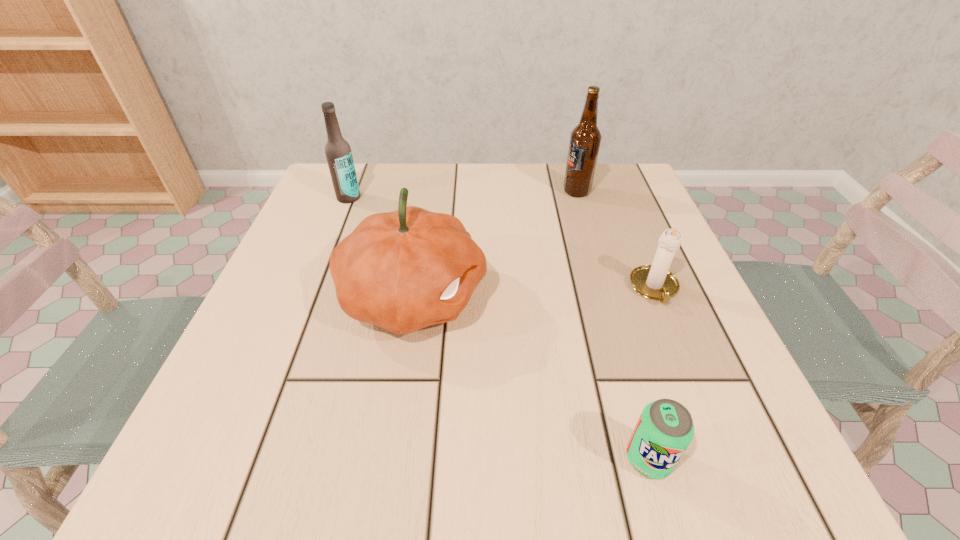
I want to click on vacant space located 0.070m on the label of the leftmost object, so click(x=339, y=222).

Find the location of a particular element. The width and height of the screenshot is (960, 540). free space located on the front face of the pumpkin is located at coordinates (699, 297).

Where is `vacant space located on the handle side of the second shortest object`? This screenshot has height=540, width=960. vacant space located on the handle side of the second shortest object is located at coordinates (696, 389).

The image size is (960, 540). I want to click on object that is positioned at the near edge, so click(x=665, y=428).

Locate an element on the screen. This screenshot has width=960, height=540. beer bottle situated at the left edge is located at coordinates (338, 152).

Where is `pumpkin that is positioned at the left edge`? The height and width of the screenshot is (540, 960). pumpkin that is positioned at the left edge is located at coordinates (404, 270).

At what (x,y) coordinates should I click in order to perform the action: click on beer bottle present at the right edge. Please return your answer as a coordinate pair (x, y). Looking at the image, I should click on (585, 139).

You are a GUI agent. You are given a task and a screenshot of the screen. Output one action in this format:
    pyautogui.click(x=<x>, y=<y>)
    Task: Click on the candle holder that is at the right edge
    Image resolution: width=960 pixels, height=540 pixels.
    Given the screenshot: What is the action you would take?
    pyautogui.click(x=655, y=282)

Where is `pop soda positioned at the right edge`? Image resolution: width=960 pixels, height=540 pixels. pop soda positioned at the right edge is located at coordinates (665, 428).

Where is `object at the far left corner`? Image resolution: width=960 pixels, height=540 pixels. object at the far left corner is located at coordinates (338, 152).